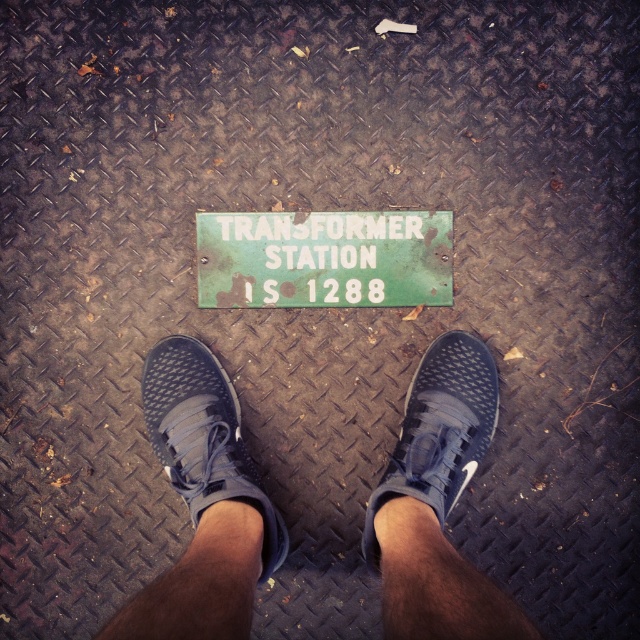
Question: Among these objects, which one is nearest to the camera?

Choices:
 (A) black mesh shoe at center
 (B) green rusted sign at center

Answer: (A)

Question: Which object is the farthest from the black mesh shoe at center?

Choices:
 (A) blue mesh sneakers at center
 (B) matte blue sneaker at center

Answer: (B)

Question: Is blue mesh sneakers at center in front of green rusted sign at center?

Choices:
 (A) yes
 (B) no

Answer: (A)

Question: Is green rusted sign at center closer to camera compared to black mesh shoe at center?

Choices:
 (A) no
 (B) yes

Answer: (A)

Question: Which point is closer to the camera taking this photo?

Choices:
 (A) (257, 282)
 (B) (218, 572)
 (C) (420, 417)
 (D) (211, 476)

Answer: (B)

Question: From the image, what is the correct spatial relationship of matte blue sneaker at center in relation to black mesh shoe at center?

Choices:
 (A) right
 (B) left

Answer: (B)